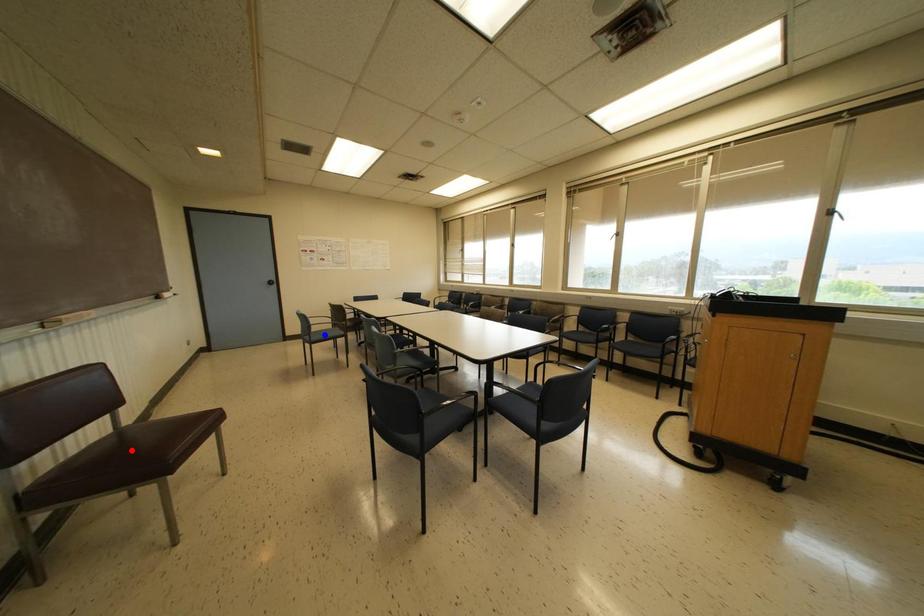
Question: Two points are marked on the image. Which point is closer to the camera?

Choices:
 (A) Blue point is closer.
 (B) Red point is closer.

Answer: (B)